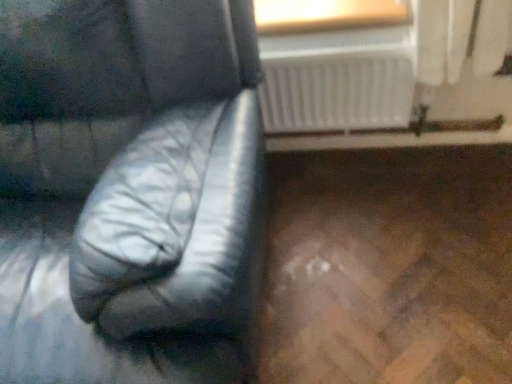
Identify the location of black leather armchair at left. (129, 190).

At what (x,y) coordinates should I click in order to perform the action: click on wooden frame at upper center. Please return your answer as a coordinate pair (x, y). Looking at the image, I should click on (326, 15).

At what (x,y) coordinates should I click in order to perform the action: click on white plastic radiator at upper center. Please return your answer as a coordinate pair (x, y). This screenshot has width=512, height=384. Looking at the image, I should click on (337, 80).

Is white plastic radiator at upper center located outside black leather armchair at left?

Yes.

Is white plastic radiator at upper center far from black leather armchair at left?

No, white plastic radiator at upper center is not far away from black leather armchair at left.

Is the depth of white plastic radiator at upper center less than that of black leather armchair at left?

No, white plastic radiator at upper center is further to the viewer.

From a real-world perspective, which object stands above the other?

black leather armchair at left is physically above.

Is black leather armchair at left to the left of white plastic radiator at upper center from the viewer's perspective?

Yes.

Would you say black leather armchair at left is outside white plastic radiator at upper center?

black leather armchair at left lies outside white plastic radiator at upper center's area.

Measure the distance between black leather armchair at left and white plastic radiator at upper center.

18.97 inches.

Is point (153, 52) farther from camera compared to point (377, 55)?

No.

Is wooden frame at upper center bigger or smaller than white plastic radiator at upper center?

Considering their sizes, wooden frame at upper center takes up less space than white plastic radiator at upper center.

Is wooden frame at upper center next to white plastic radiator at upper center and touching it?

No, wooden frame at upper center is not with white plastic radiator at upper center.

Considering the relative sizes of wooden frame at upper center and white plastic radiator at upper center in the image provided, is wooden frame at upper center thinner than white plastic radiator at upper center?

No, wooden frame at upper center is not thinner than white plastic radiator at upper center.

From a real-world perspective, is wooden frame at upper center physically located above or below white plastic radiator at upper center?

wooden frame at upper center is above white plastic radiator at upper center.

Are black leather armchair at left and wooden frame at upper center located far from each other?

black leather armchair at left is actually quite close to wooden frame at upper center.

Between black leather armchair at left and wooden frame at upper center, which one has smaller width?

Thinner between the two is wooden frame at upper center.

Which is behind, point (124, 302) or point (401, 3)?

The point (401, 3) is farther.

In the image, there is a black leather armchair at left. What are the coordinates of `window frame above it (from the image's perspective)` in the screenshot? It's located at (326, 15).

Is white plastic radiator at upper center facing away from wooden frame at upper center?

Yes, wooden frame at upper center is at the back of white plastic radiator at upper center.

Considering the positions of points (376, 63) and (331, 12), is point (376, 63) farther from camera compared to point (331, 12)?

Yes.

From the image's perspective, which one is positioned higher, white plastic radiator at upper center or wooden frame at upper center?

wooden frame at upper center, from the image's perspective.

Is white plastic radiator at upper center positioned far away from wooden frame at upper center?

No, there isn't a large distance between white plastic radiator at upper center and wooden frame at upper center.

From the image's perspective, is wooden frame at upper center over black leather armchair at left?

Yes, from the image's perspective, wooden frame at upper center is on top of black leather armchair at left.

Does wooden frame at upper center come behind black leather armchair at left?

Yes, wooden frame at upper center is behind black leather armchair at left.

From a real-world perspective, which object stands above the other?

From a 3D spatial view, wooden frame at upper center is above.

Image resolution: width=512 pixels, height=384 pixels. I want to click on furniture that is below the white plastic radiator at upper center (from the image's perspective), so click(129, 190).

Locate an element on the screen. The image size is (512, 384). furniture that is on the left side of white plastic radiator at upper center is located at coordinates (129, 190).

Looking at the image, which one is located closer to wooden frame at upper center, black leather armchair at left or white plastic radiator at upper center?

white plastic radiator at upper center is positioned closer to the anchor wooden frame at upper center.

Considering their positions, is wooden frame at upper center positioned closer to white plastic radiator at upper center than black leather armchair at left?

wooden frame at upper center lies closer to white plastic radiator at upper center than the other object.

From the image, which object appears to be nearer to black leather armchair at left, white plastic radiator at upper center or wooden frame at upper center?

Among the two, white plastic radiator at upper center is located nearer to black leather armchair at left.

In the scene shown: Considering their positions, is wooden frame at upper center positioned further to black leather armchair at left than white plastic radiator at upper center?

The object further to black leather armchair at left is wooden frame at upper center.

Estimate the real-world distances between objects in this image. Which object is closer to white plastic radiator at upper center, black leather armchair at left or wooden frame at upper center?

wooden frame at upper center.

From the image, which object appears to be nearer to wooden frame at upper center, white plastic radiator at upper center or black leather armchair at left?

white plastic radiator at upper center is positioned closer to the anchor wooden frame at upper center.

Where is `radiator located between black leather armchair at left and wooden frame at upper center in the depth direction`? Image resolution: width=512 pixels, height=384 pixels. radiator located between black leather armchair at left and wooden frame at upper center in the depth direction is located at coordinates (337, 80).